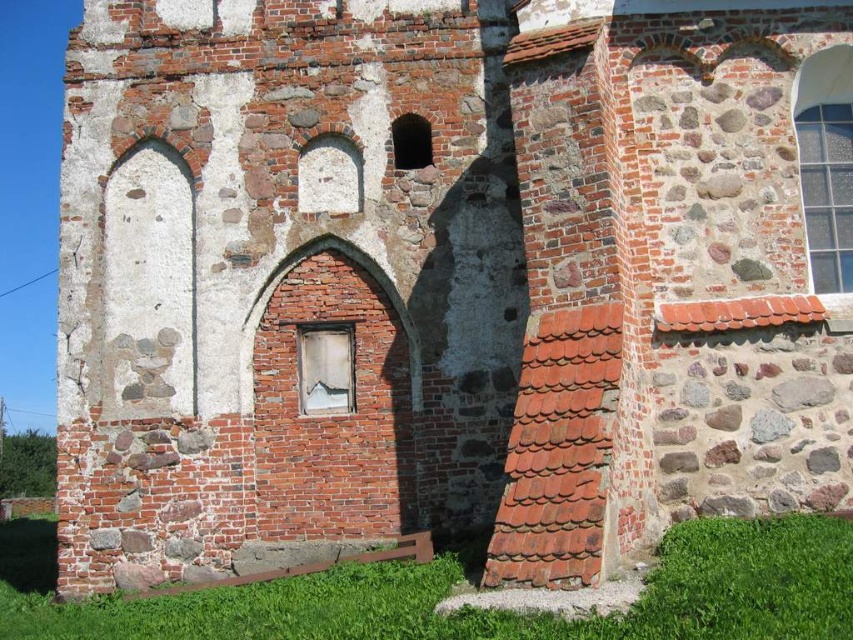
You are standing in front of the historic stone building and want to touch both points marked on the building. Which point, point (x=850, y=269) or point (x=318, y=339), will you reach first as you move toward the building?

Point (x=850, y=269) is in front of point (x=318, y=339), so you will reach point (x=850, y=269) first as you move toward the building.

You are an architect examining the historic stone building. You notice the transparent glass window at center and the smooth stone arch at center. Which of these two features has a larger size?

The smooth stone arch at center is larger in size compared to the transparent glass window at center.